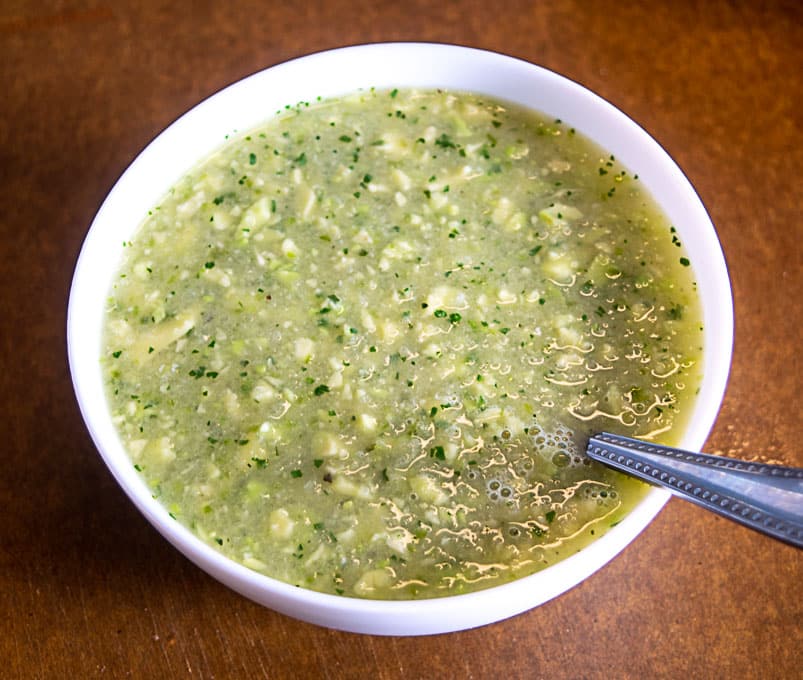
Find the location of a particular element. tabletop is located at coordinates [x=217, y=632], [x=128, y=62], [x=759, y=241].